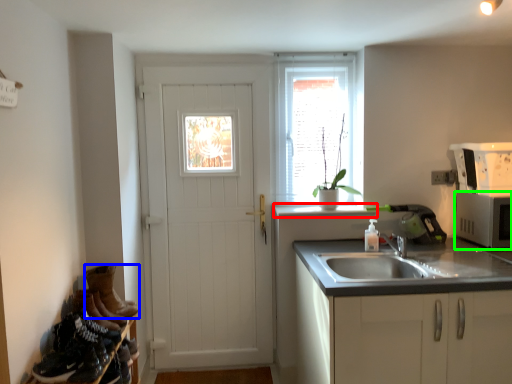
Question: Considering the real-world distances, which object is farthest from window sill (highlighted by a red box)? footwear (highlighted by a blue box) or appliance (highlighted by a green box)?

Choices:
 (A) footwear
 (B) appliance

Answer: (A)